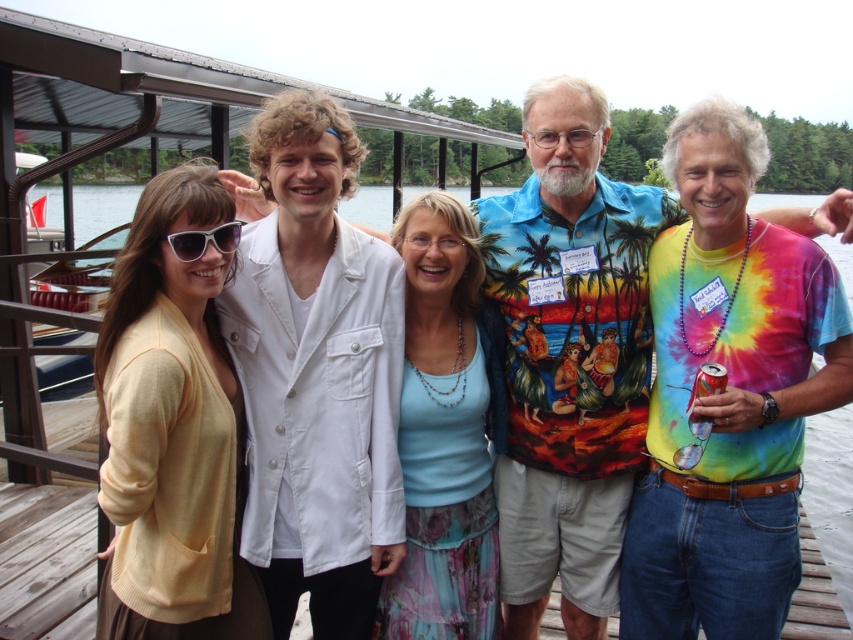
You are a photographer trying to adjust the lighting setup for a group photo. You notice the matte yellow cardigan at center and the blue fabric skirt at center. Which of these two items requires more space in the frame to avoid being cut off?

The matte yellow cardigan at center is larger in size than the blue fabric skirt at center, so it requires more space in the frame to avoid being cut off.

You are a photographer trying to capture the blue fabric skirt at center in your shot. Based on the coordinates provided, where should you position your camera to ensure the skirt is centered in the frame?

The blue fabric skirt at center is located at coordinates point (444,433), so positioning the camera to center the frame at those coordinates will ensure the skirt is captured in the center of the image.